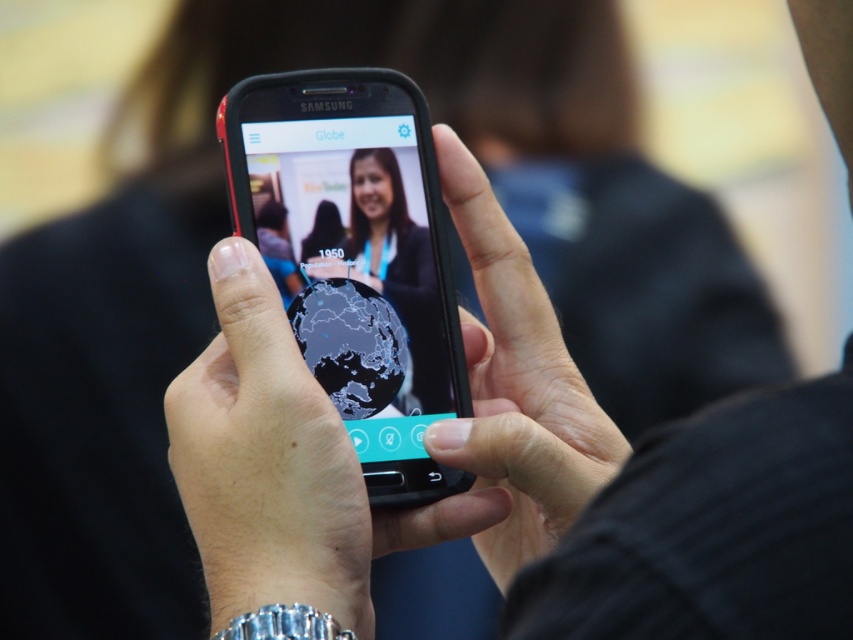
You are trying to determine the distance between two points on the phone screen. The first point is labeled as point (436, 355) and the second is point (392, 189). According to the scene, which point is nearer to you?

Point (436, 355) is closer to the camera than point (392, 189).

What is the exact coordinate of the smooth skin hand at center?

The smooth skin hand at center is located at point (517, 387).

You see a black glossy phone at center and a matte black globe at center in the image. Which object is positioned to the right?

The matte black globe at center is positioned to the right of the black glossy phone at center.